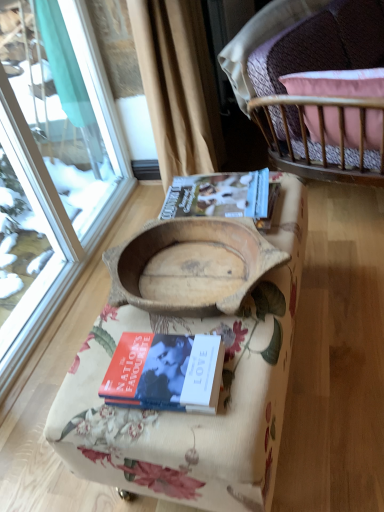
Question: Are hardcover book at center, which is the first book from bottom to top, and wooden bowl at center located far from each other?

Choices:
 (A) yes
 (B) no

Answer: (B)

Question: Can you confirm if hardcover book at center, which is the first book from bottom to top, is thinner than wooden bowl at center?

Choices:
 (A) yes
 (B) no

Answer: (A)

Question: Is hardcover book at center, the first book in the front-to-back sequence, at the left side of wooden bowl at center?

Choices:
 (A) no
 (B) yes

Answer: (B)

Question: From the image's perspective, does hardcover book at center, arranged as the second book when viewed from the back, appear lower than wooden bowl at center?

Choices:
 (A) no
 (B) yes

Answer: (B)

Question: Can wooden bowl at center be found inside hardcover book at center, marked as the 2th book in a top-to-bottom arrangement?

Choices:
 (A) yes
 (B) no

Answer: (B)

Question: Can you confirm if hardcover book at center, the first book in the front-to-back sequence, is taller than wooden bowl at center?

Choices:
 (A) yes
 (B) no

Answer: (B)

Question: Can you confirm if hardcover book at center, the first book in the front-to-back sequence, is thinner than wooden cradle at center?

Choices:
 (A) yes
 (B) no

Answer: (A)

Question: Is hardcover book at center, marked as the 2th book in a top-to-bottom arrangement, looking in the opposite direction of wooden cradle at center?

Choices:
 (A) no
 (B) yes

Answer: (A)

Question: Can you see hardcover book at center, which is the first book from bottom to top, touching wooden cradle at center?

Choices:
 (A) yes
 (B) no

Answer: (B)

Question: Is hardcover book at center, which is the first book from bottom to top, in front of wooden cradle at center?

Choices:
 (A) no
 (B) yes

Answer: (B)

Question: Does hardcover book at center, which is the first book from bottom to top, lie behind wooden cradle at center?

Choices:
 (A) yes
 (B) no

Answer: (B)

Question: Can you confirm if wooden bowl at center is positioned to the left of wooden cradle at center?

Choices:
 (A) yes
 (B) no

Answer: (B)